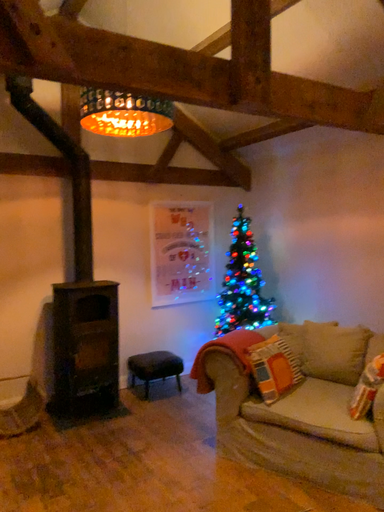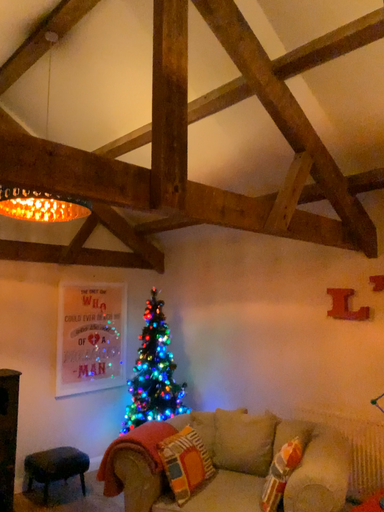
Question: How did the camera likely rotate when shooting the video?

Choices:
 (A) rotated right
 (B) rotated left

Answer: (A)